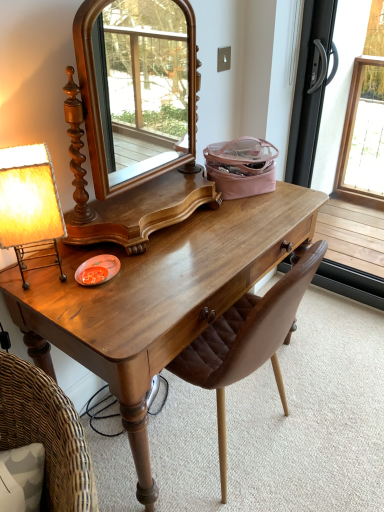
Question: Is point (266, 357) closer or farther from the camera than point (327, 11)?

Choices:
 (A) closer
 (B) farther

Answer: (A)

Question: Is brown leather chair at center wider or thinner than transparent glass screen door at right?

Choices:
 (A) thin
 (B) wide

Answer: (B)

Question: Considering the real-world distances, which object is closest to the matte yellow fabric lampshade at left?

Choices:
 (A) brown leather chair at center
 (B) shiny brown wooden desk at center
 (C) transparent glass screen door at right

Answer: (B)

Question: Which of these objects is positioned farthest from the matte yellow fabric lampshade at left?

Choices:
 (A) transparent glass screen door at right
 (B) shiny brown wooden desk at center
 (C) brown leather chair at center

Answer: (A)